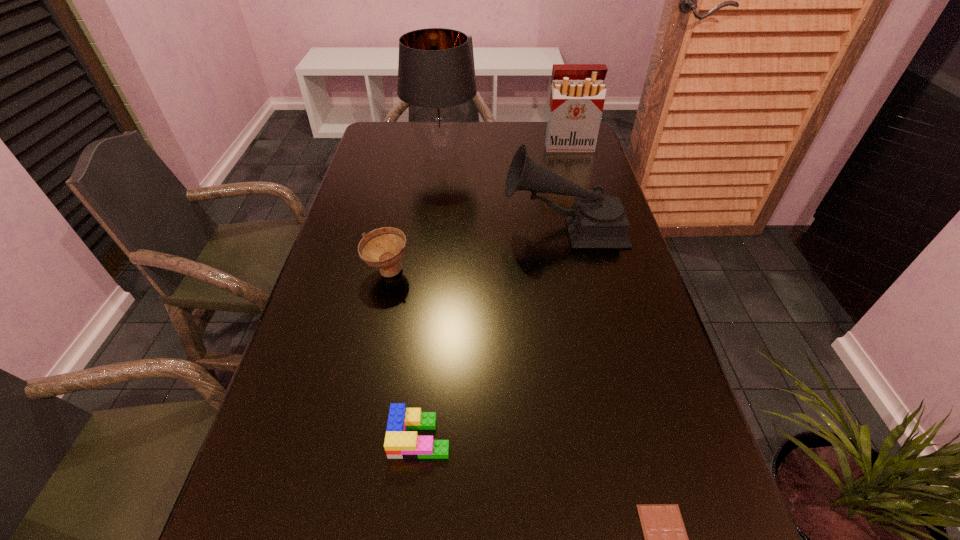
Identify the location of lampshade. (435, 73).

Identify the location of cigarette case. The height and width of the screenshot is (540, 960). (577, 97).

Where is `the third farthest object`? The image size is (960, 540). the third farthest object is located at coordinates (596, 221).

At what (x,y) coordinates should I click in order to perform the action: click on the fourth farthest object. Please return your answer as a coordinate pair (x, y). The image size is (960, 540). Looking at the image, I should click on 383,248.

Where is `soup bowl`? The height and width of the screenshot is (540, 960). soup bowl is located at coordinates (383, 248).

Identify the location of Lego. (399, 444).

I want to click on the fifth farthest object, so click(399, 444).

At what (x,y) coordinates should I click in order to perform the action: click on vacant space located 0.110m on the back of the lampshade. Please return your answer as a coordinate pair (x, y). Looking at the image, I should click on (445, 123).

Where is `vacant area located 0.350m with the lid open on the cigarette case`? The image size is (960, 540). vacant area located 0.350m with the lid open on the cigarette case is located at coordinates (588, 214).

The width and height of the screenshot is (960, 540). In order to click on vacant area located 0.060m from the horn of the phonograph_record in this screenshot , I will do `click(482, 227)`.